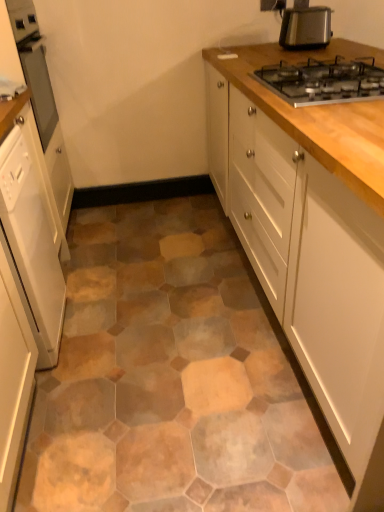
Question: Does white wood cabinet at upper right, arranged as the 1th cabinetry when viewed from the right, come behind metallic silver toaster at upper right?

Choices:
 (A) no
 (B) yes

Answer: (A)

Question: Is white wood cabinet at upper right, arranged as the 1th cabinetry when viewed from the right, in contact with metallic silver toaster at upper right?

Choices:
 (A) no
 (B) yes

Answer: (A)

Question: From a real-world perspective, is white wood cabinet at upper right, which ranks as the 3th cabinetry in left-to-right order, positioned over metallic silver toaster at upper right based on gravity?

Choices:
 (A) no
 (B) yes

Answer: (A)

Question: From the image's perspective, is white wood cabinet at upper right, which ranks as the 3th cabinetry in left-to-right order, located above metallic silver toaster at upper right?

Choices:
 (A) yes
 (B) no

Answer: (B)

Question: From the image's perspective, is white wood cabinet at upper right, which ranks as the 3th cabinetry in left-to-right order, located beneath metallic silver toaster at upper right?

Choices:
 (A) no
 (B) yes

Answer: (B)

Question: From the image's perspective, is white glossy dishwasher at left, marked as the first cabinetry in a left-to-right arrangement, located above or below white wood cabinet at upper right, which ranks as the 3th cabinetry in left-to-right order?

Choices:
 (A) above
 (B) below

Answer: (B)

Question: Is white glossy dishwasher at left, marked as the first cabinetry in a left-to-right arrangement, situated inside white wood cabinet at upper right, which ranks as the 3th cabinetry in left-to-right order, or outside?

Choices:
 (A) outside
 (B) inside

Answer: (A)

Question: Looking at their shapes, would you say white glossy dishwasher at left, marked as the first cabinetry in a left-to-right arrangement, is wider or thinner than white wood cabinet at upper right, arranged as the 1th cabinetry when viewed from the right?

Choices:
 (A) wide
 (B) thin

Answer: (B)

Question: Looking at the image, does white glossy dishwasher at left, marked as the first cabinetry in a left-to-right arrangement, seem bigger or smaller compared to white wood cabinet at upper right, arranged as the 1th cabinetry when viewed from the right?

Choices:
 (A) small
 (B) big

Answer: (A)

Question: From the image's perspective, is matte glass oven at left positioned above or below metallic silver toaster at upper right?

Choices:
 (A) below
 (B) above

Answer: (A)

Question: Is matte glass oven at left inside the boundaries of metallic silver toaster at upper right, or outside?

Choices:
 (A) inside
 (B) outside

Answer: (B)

Question: From a real-world perspective, is matte glass oven at left positioned above or below metallic silver toaster at upper right?

Choices:
 (A) below
 (B) above

Answer: (A)

Question: From their relative heights in the image, would you say matte glass oven at left is taller or shorter than metallic silver toaster at upper right?

Choices:
 (A) tall
 (B) short

Answer: (A)

Question: In the image, is white glossy cabinet at left, the second cabinetry positioned from the right, positioned in front of or behind white wood cabinet at upper right, which ranks as the 3th cabinetry in left-to-right order?

Choices:
 (A) behind
 (B) front

Answer: (A)

Question: Would you say white glossy cabinet at left, the second cabinetry positioned from the right, is inside or outside white wood cabinet at upper right, which ranks as the 3th cabinetry in left-to-right order?

Choices:
 (A) inside
 (B) outside

Answer: (B)